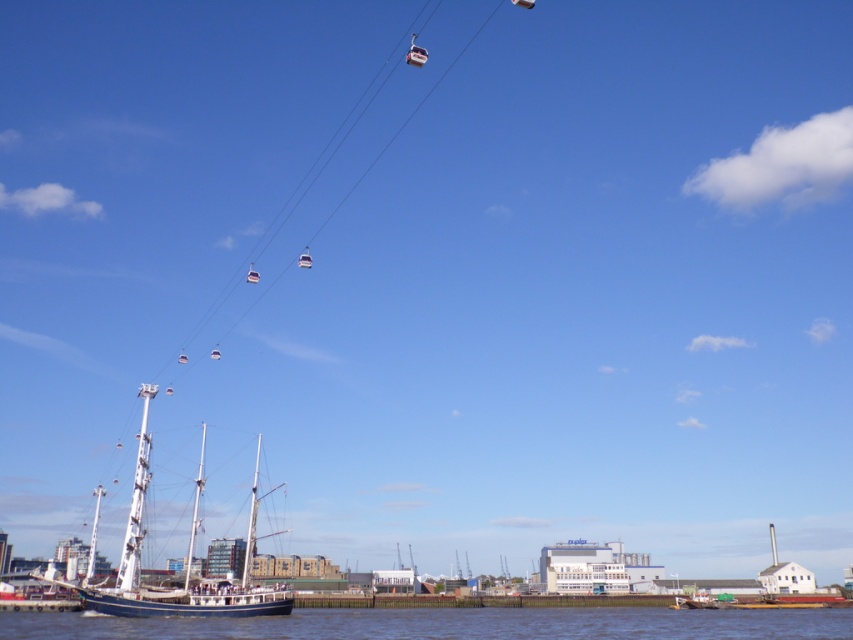
Can you confirm if blue water at lower center is taller than wooden sailboat at lower left?

Incorrect, blue water at lower center's height is not larger of wooden sailboat at lower left's.

This screenshot has width=853, height=640. What do you see at coordinates (447, 624) in the screenshot? I see `blue water at lower center` at bounding box center [447, 624].

You are a GUI agent. You are given a task and a screenshot of the screen. Output one action in this format:
    pyautogui.click(x=<x>, y=<y>)
    Task: Click on the blue water at lower center
    The height and width of the screenshot is (640, 853).
    Given the screenshot: What is the action you would take?
    pyautogui.click(x=447, y=624)

Locate an element on the screen. blue water at lower center is located at coordinates (447, 624).